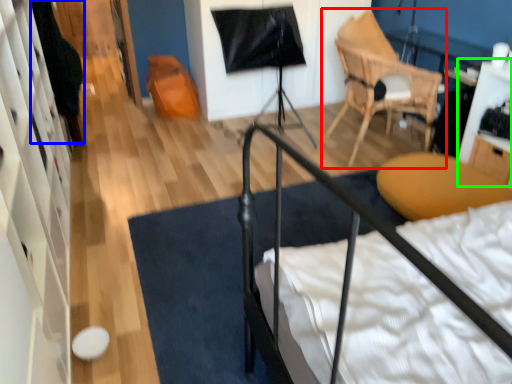
Question: Considering the real-world distances, which object is farthest from chair (highlighted by a red box)? dark (highlighted by a blue box) or table (highlighted by a green box)?

Choices:
 (A) dark
 (B) table

Answer: (A)